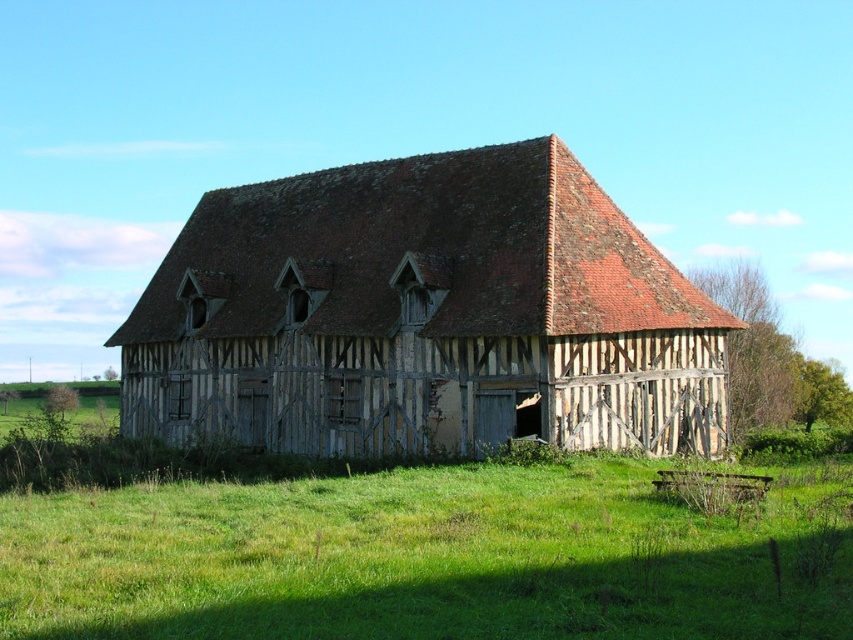
Does weathered wood barn at center have a lesser width compared to green grass at center?

No.

Who is shorter, weathered wood barn at center or green grass at center?

Standing shorter between the two is green grass at center.

Which is behind, point (318, 339) or point (51, 554)?

Point (318, 339)

Find the location of a particular element. The image size is (853, 640). weathered wood barn at center is located at coordinates (425, 316).